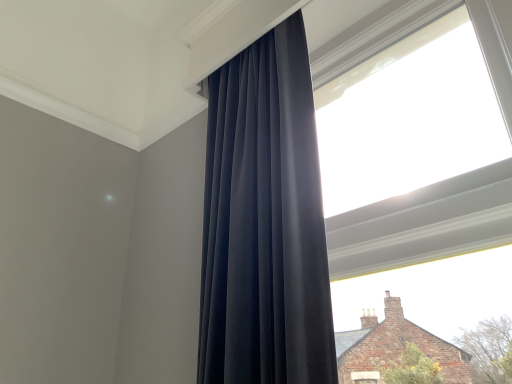
Question: Considering the positions of point (279, 64) and point (393, 261), is point (279, 64) closer or farther from the camera than point (393, 261)?

Choices:
 (A) closer
 (B) farther

Answer: (B)

Question: From the image's perspective, relative to transparent glass window at upper center, is matte black curtain at center above or below?

Choices:
 (A) below
 (B) above

Answer: (A)

Question: From their relative heights in the image, would you say matte black curtain at center is taller or shorter than transparent glass window at upper center?

Choices:
 (A) short
 (B) tall

Answer: (A)

Question: In the image, is transparent glass window at upper center positioned in front of or behind matte black curtain at center?

Choices:
 (A) front
 (B) behind

Answer: (A)

Question: Is point (482, 21) positioned closer to the camera than point (215, 344)?

Choices:
 (A) farther
 (B) closer

Answer: (A)

Question: From the image's perspective, relative to matte black curtain at center, is transparent glass window at upper center above or below?

Choices:
 (A) above
 (B) below

Answer: (A)

Question: From a real-world perspective, is transparent glass window at upper center physically located above or below matte black curtain at center?

Choices:
 (A) above
 (B) below

Answer: (A)